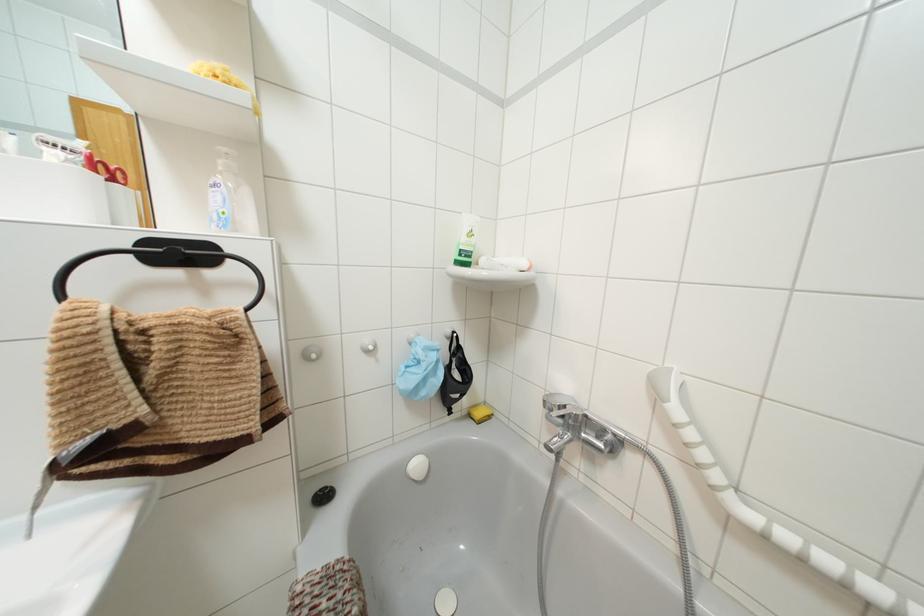
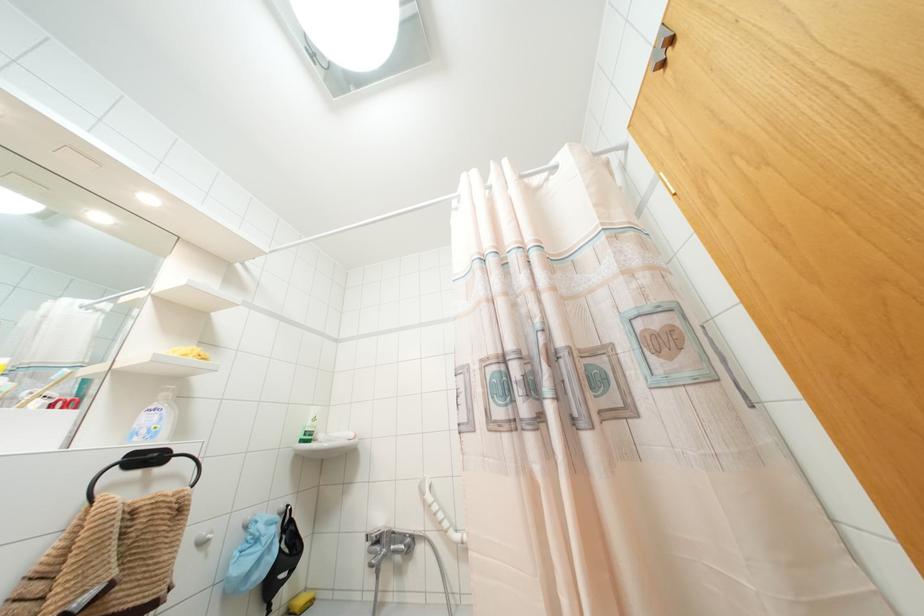
Where in the second image is the point corresponding to [184,253] from the first image?

(147, 458)